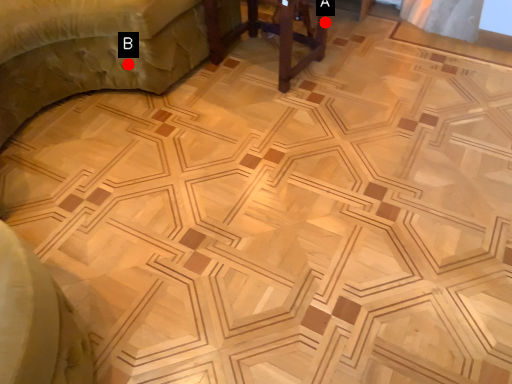
Question: Two points are circled on the image, labeled by A and B beside each circle. Which of the following is the farthest from the observer?

Choices:
 (A) A is further
 (B) B is further

Answer: (A)